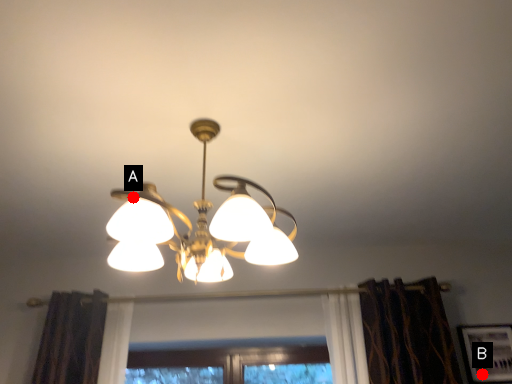
Question: Two points are circled on the image, labeled by A and B beside each circle. Among these points, which one is nearest to the camera?

Choices:
 (A) A is closer
 (B) B is closer

Answer: (A)